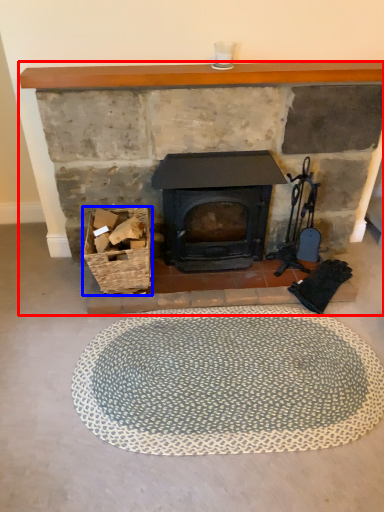
Question: Among these objects, which one is nearest to the camera, fireplace (highlighted by a red box) or basket (highlighted by a blue box)?

Choices:
 (A) fireplace
 (B) basket

Answer: (A)